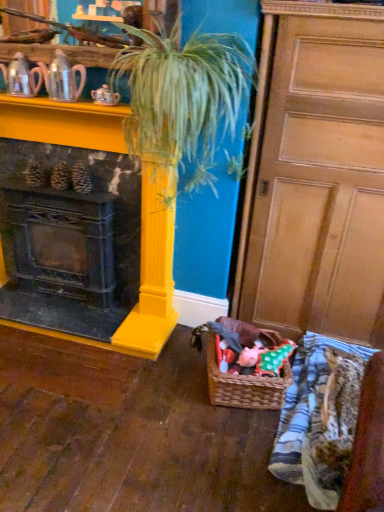
Question: Would you say striped cotton blanket at lower right is a long distance from woven brown basket at lower center?

Choices:
 (A) no
 (B) yes

Answer: (A)

Question: Can you confirm if striped cotton blanket at lower right is thinner than woven brown basket at lower center?

Choices:
 (A) no
 (B) yes

Answer: (A)

Question: Is striped cotton blanket at lower right oriented towards woven brown basket at lower center?

Choices:
 (A) no
 (B) yes

Answer: (B)

Question: Would you say striped cotton blanket at lower right is outside woven brown basket at lower center?

Choices:
 (A) yes
 (B) no

Answer: (A)

Question: From a real-world perspective, is striped cotton blanket at lower right beneath woven brown basket at lower center?

Choices:
 (A) yes
 (B) no

Answer: (A)

Question: Based on their positions, is black cast iron fireplace at left located to the left or right of wooden at center?

Choices:
 (A) left
 (B) right

Answer: (A)

Question: In terms of size, does black cast iron fireplace at left appear bigger or smaller than wooden at center?

Choices:
 (A) big
 (B) small

Answer: (B)

Question: From their relative heights in the image, would you say black cast iron fireplace at left is taller or shorter than wooden at center?

Choices:
 (A) tall
 (B) short

Answer: (B)

Question: From the image's perspective, is black cast iron fireplace at left above or below wooden at center?

Choices:
 (A) below
 (B) above

Answer: (A)

Question: From the image's perspective, is black cast iron fireplace at left above or below woven brown basket at lower center?

Choices:
 (A) below
 (B) above

Answer: (B)

Question: Is black cast iron fireplace at left wider or thinner than woven brown basket at lower center?

Choices:
 (A) wide
 (B) thin

Answer: (B)

Question: Is point (87, 145) closer or farther from the camera than point (208, 371)?

Choices:
 (A) farther
 (B) closer

Answer: (A)

Question: From a real-world perspective, relative to woven brown basket at lower center, is black cast iron fireplace at left vertically above or below?

Choices:
 (A) above
 (B) below

Answer: (A)

Question: Is matte silver teapot at upper left, which is counted as the first tea pot, starting from the right, to the left or to the right of velvety plush toy at lower center in the image?

Choices:
 (A) right
 (B) left

Answer: (B)

Question: Is point (54, 84) closer or farther from the camera than point (246, 353)?

Choices:
 (A) closer
 (B) farther

Answer: (A)